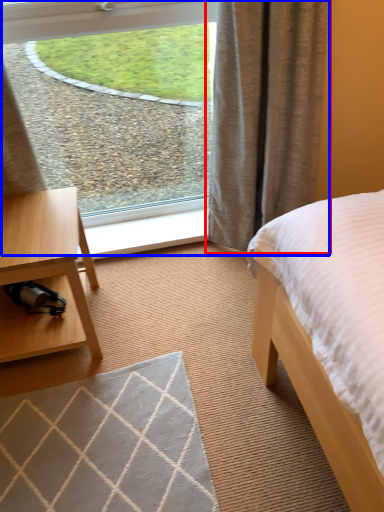
Question: Which of the following is the farthest to the observer, curtain (highlighted by a red box) or window (highlighted by a blue box)?

Choices:
 (A) curtain
 (B) window

Answer: (B)